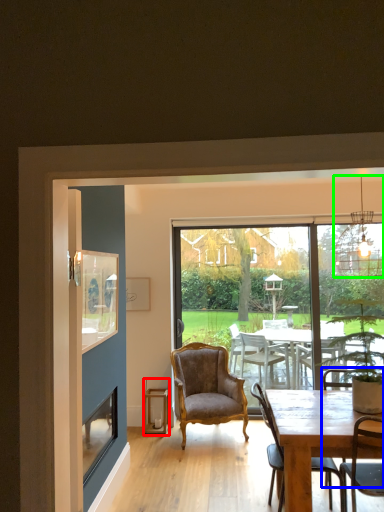
Question: Which is nearer to the lantern (highlighted by a red box)? armchair (highlighted by a blue box) or lamp (highlighted by a green box).

Choices:
 (A) armchair
 (B) lamp

Answer: (A)